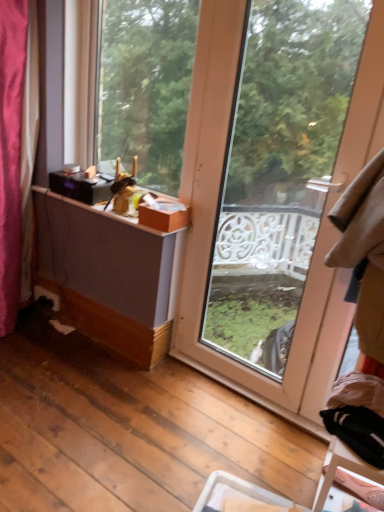
Question: Would you say transparent glass door at center, the first window positioned from the right, is to the left or to the right of matte wood window at center, which ranks as the second window in right-to-left order, in the picture?

Choices:
 (A) right
 (B) left

Answer: (A)

Question: From the image's perspective, relative to matte wood window at center, which ranks as the 1th window in left-to-right order, is transparent glass door at center, the first window positioned from the right, above or below?

Choices:
 (A) below
 (B) above

Answer: (A)

Question: Which object is the farthest from the transparent glass door at center, placed as the second window when sorted from left to right?

Choices:
 (A) orange cardboard box at upper center
 (B) matte wood window at center, which ranks as the second window in right-to-left order

Answer: (B)

Question: Which is farther from the matte wood window at center, which ranks as the second window in right-to-left order?

Choices:
 (A) orange cardboard box at upper center
 (B) transparent glass door at center, placed as the second window when sorted from left to right

Answer: (A)